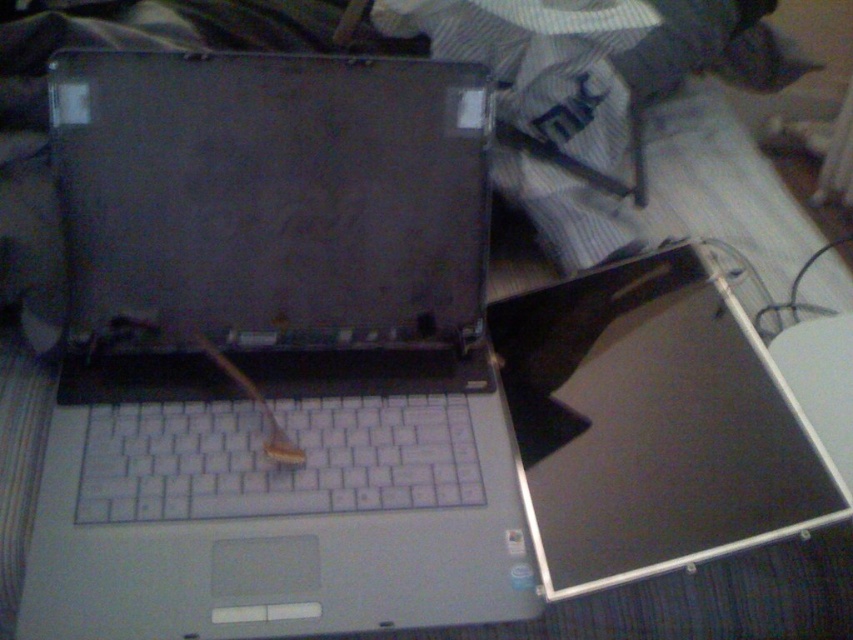
Between satin silver laptop at center and satin black screen at center, which one appears on the right side from the viewer's perspective?

From the viewer's perspective, satin black screen at center appears more on the right side.

Can you confirm if satin silver laptop at center is shorter than satin black screen at center?

No, satin silver laptop at center is not shorter than satin black screen at center.

Between point (437, 156) and point (582, 477), which one is positioned in front?

Point (582, 477) is in front.

Locate an element on the screen. The width and height of the screenshot is (853, 640). satin silver laptop at center is located at coordinates (274, 353).